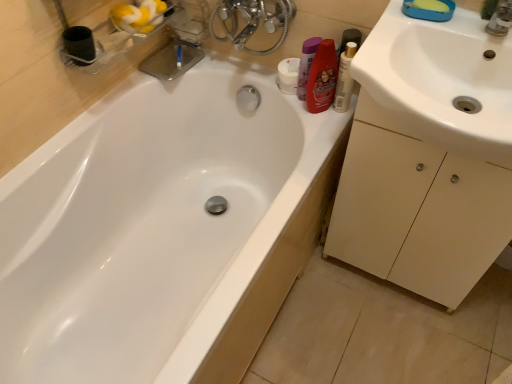
Question: In terms of size, does white glossy bathtub at upper left appear bigger or smaller than white glossy sink at right?

Choices:
 (A) big
 (B) small

Answer: (A)

Question: From a real-world perspective, is white glossy bathtub at upper left physically located above or below white glossy sink at right?

Choices:
 (A) above
 (B) below

Answer: (B)

Question: Which object is the farthest from the shiny plastic shampoo bottle at upper center, which is counted as the 3th toiletry, starting from the right?

Choices:
 (A) white glossy sink at right
 (B) white glossy bathtub at upper left
 (C) white plastic mouthwash at upper right
 (D) beige matte cabinet at right
 (E) shiny red bottle at upper right, the first toiletry viewed from the right

Answer: (B)

Question: Estimate the real-world distances between objects in this image. Which object is farther from the white glossy sink at right?

Choices:
 (A) purple plastic bottle at upper right, positioned as the 2th toiletry in right-to-left order
 (B) shiny plastic shampoo bottle at upper center, the first toiletry in the left-to-right sequence
 (C) yellow sponge at upper right
 (D) shiny red bottle at upper right, the first toiletry viewed from the right
 (E) white plastic mouthwash at upper right

Answer: (B)